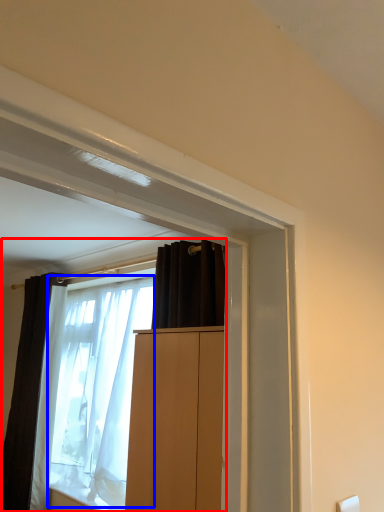
Question: Which object is closer to the camera taking this photo, window (highlighted by a red box) or shower curtain (highlighted by a blue box)?

Choices:
 (A) window
 (B) shower curtain

Answer: (A)